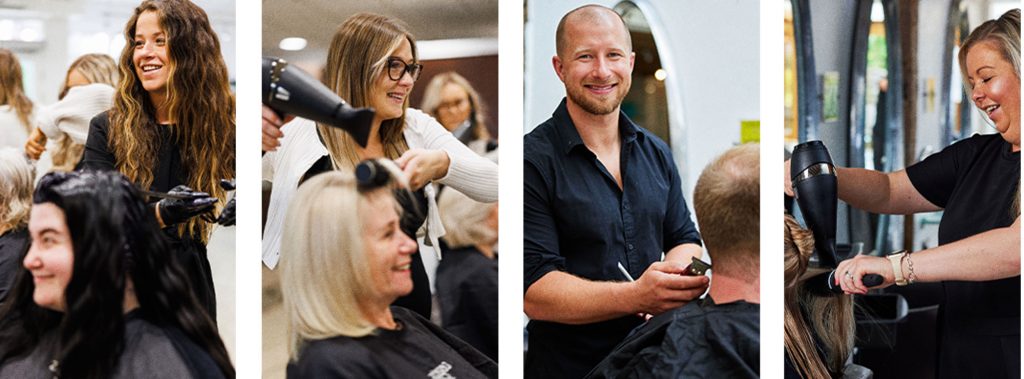
Locate an element on the screen. hairdryers is located at coordinates (311, 101), (818, 203).